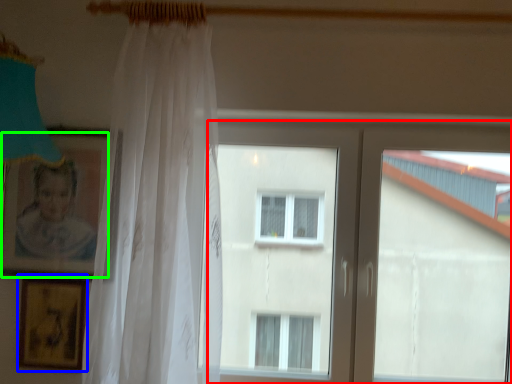
Question: Which object is the farthest from window (highlighted by a red box)? Choose among these: picture frame (highlighted by a blue box) or picture frame (highlighted by a green box).

Choices:
 (A) picture frame
 (B) picture frame

Answer: (A)